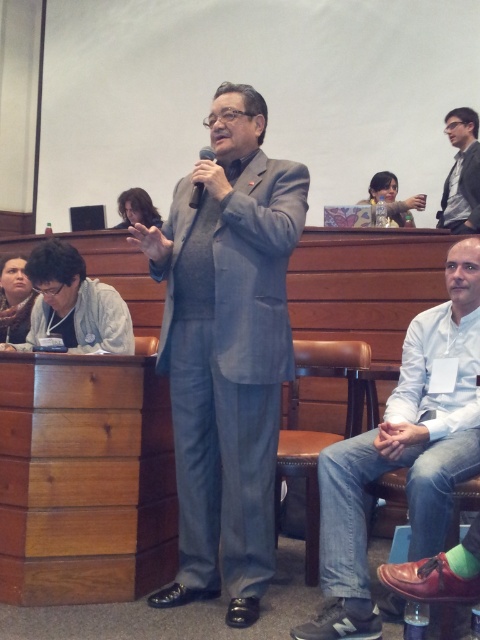
Question: Which of the following is the farthest from the observer?

Choices:
 (A) matte black suit at upper right
 (B) black matte microphone at center

Answer: (A)

Question: Which object is closer to the camera taking this photo?

Choices:
 (A) white cotton shirt at lower right
 (B) matte black suit at upper right
 (C) gray fabric suit at center
 (D) black matte microphone at center

Answer: (A)

Question: Observing the image, what is the correct spatial positioning of white cotton shirt at lower right in reference to matte black suit at upper right?

Choices:
 (A) right
 (B) left

Answer: (B)

Question: Can you confirm if gray fabric suit at center is positioned to the right of white cotton shirt at lower right?

Choices:
 (A) no
 (B) yes

Answer: (A)

Question: Can you confirm if white cotton shirt at lower right is positioned to the right of black matte microphone at center?

Choices:
 (A) yes
 (B) no

Answer: (A)

Question: Which is nearer to the white cotton shirt at lower right?

Choices:
 (A) matte black suit at upper right
 (B) gray fabric suit at center
 (C) black matte microphone at center

Answer: (B)